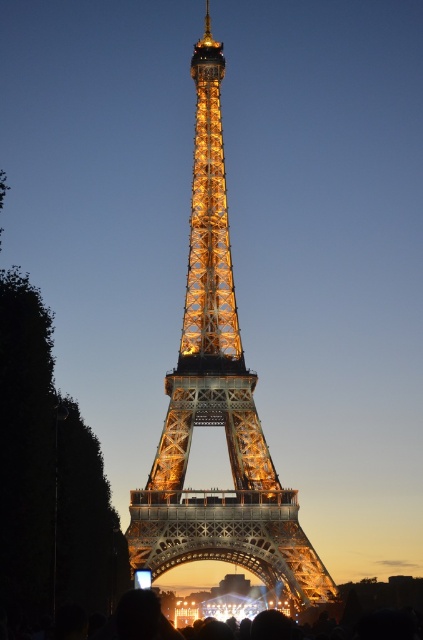
Based on the photo, does illuminated steel eiffel tower at center have a greater height compared to black matte crowd at lower center?

Indeed, illuminated steel eiffel tower at center has a greater height compared to black matte crowd at lower center.

Does illuminated steel eiffel tower at center come behind black matte crowd at lower center?

No, it is in front of black matte crowd at lower center.

This screenshot has height=640, width=423. In order to click on illuminated steel eiffel tower at center in this screenshot , I will do `click(217, 404)`.